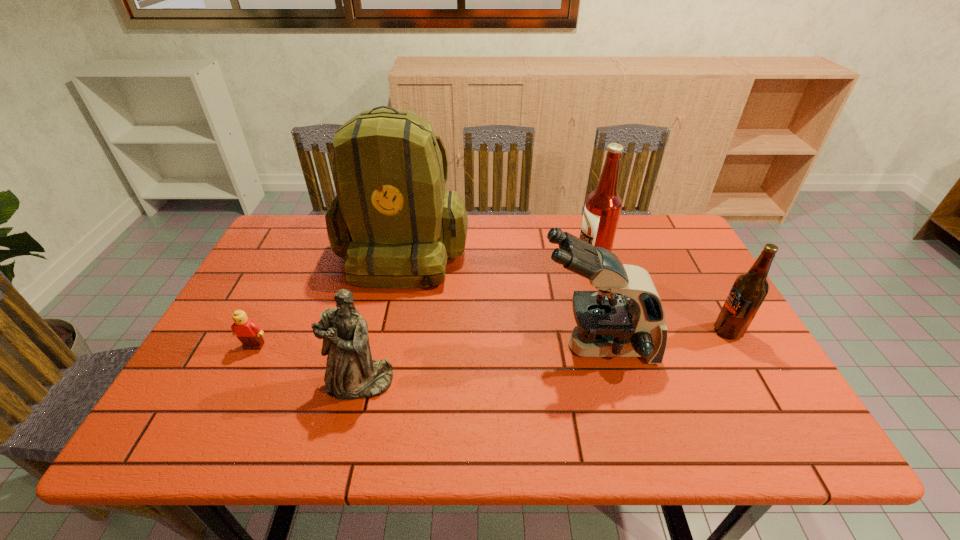
Locate an element on the screen. Image resolution: width=960 pixels, height=540 pixels. vacant space situated 0.070m on the label side of the alcohol is located at coordinates (552, 261).

Find the location of a particular element. The image size is (960, 540). vacant space located 0.310m through the eyepieces of the microscope is located at coordinates (410, 346).

Locate an element on the screen. vacant region located 0.170m through the eyepieces of the microscope is located at coordinates (468, 346).

This screenshot has width=960, height=540. What are the coordinates of `vacant position located 0.230m through the eyepieces of the microscope` in the screenshot? It's located at (443, 346).

Find the location of a particular element. The height and width of the screenshot is (540, 960). vacant space situated on the label of the rightmost object is located at coordinates (659, 331).

The height and width of the screenshot is (540, 960). I want to click on vacant space positioned on the label of the rightmost object, so click(614, 331).

I want to click on free location located on the label of the rightmost object, so [666, 331].

I want to click on free region located on the front-facing side of the figurine, so coord(350,422).

This screenshot has width=960, height=540. In order to click on free space located on the face of the leftmost object in this screenshot , I will do `click(221, 414)`.

This screenshot has width=960, height=540. What are the coordinates of `backpack located in the far edge section of the desktop` in the screenshot? It's located at (392, 220).